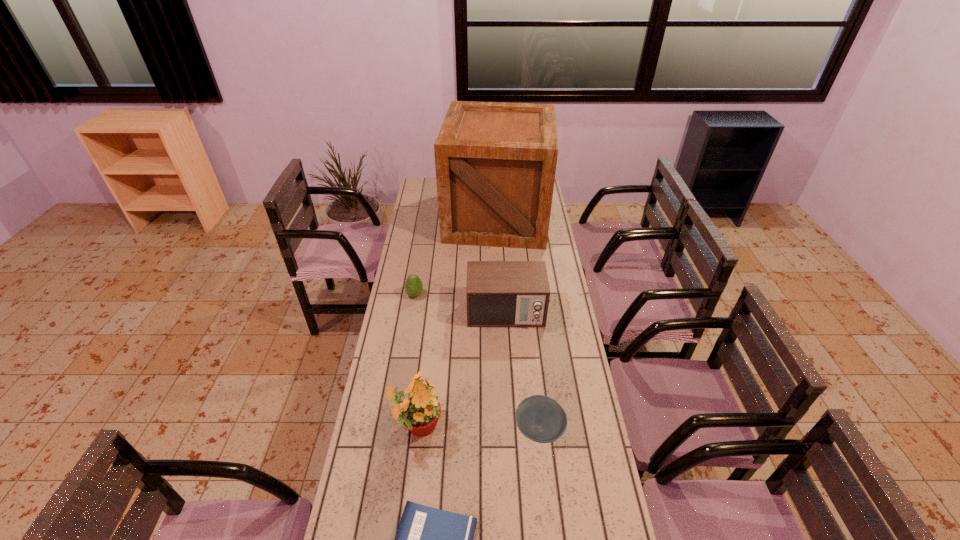
You are a GUI agent. You are given a task and a screenshot of the screen. Output one action in this format:
    pyautogui.click(x=<x>, y=<y>)
    Task: Click on the vacant area situated 0.380m on the left of the bowl
    This screenshot has width=960, height=540.
    Given the screenshot: What is the action you would take?
    pyautogui.click(x=398, y=429)

The image size is (960, 540). In order to click on object that is at the far edge in this screenshot , I will do `click(495, 162)`.

This screenshot has width=960, height=540. What are the coordinates of `flowerpot positioned at the left edge` in the screenshot? It's located at click(419, 411).

Locate an element on the screen. avocado located in the left edge section of the desktop is located at coordinates (413, 286).

Find the location of a particular element. Image resolution: width=960 pixels, height=540 pixels. box that is at the right edge is located at coordinates (495, 162).

Locate an element on the screen. radio receiver at the right edge is located at coordinates (499, 293).

At what (x,y) coordinates should I click in order to perform the action: click on bowl that is at the right edge. Please return your answer as a coordinate pair (x, y). Image resolution: width=960 pixels, height=540 pixels. Looking at the image, I should click on (540, 418).

Locate an element on the screen. This screenshot has width=960, height=540. object that is at the far right corner is located at coordinates (495, 162).

In the image, there is a desktop. Identify the location of free space at the left edge. (420, 228).

In the image, there is a desktop. Where is `free space at the right edge`? free space at the right edge is located at coordinates (551, 347).